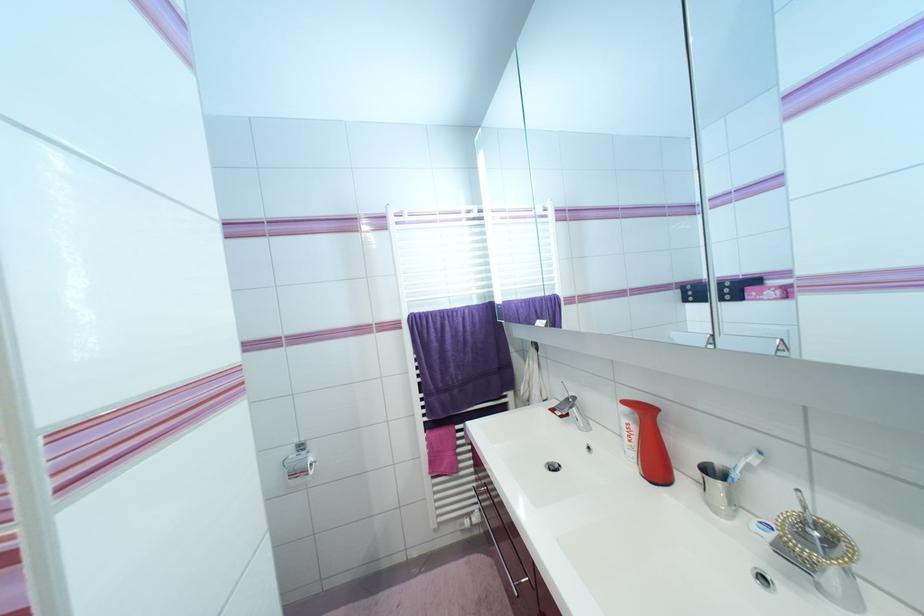
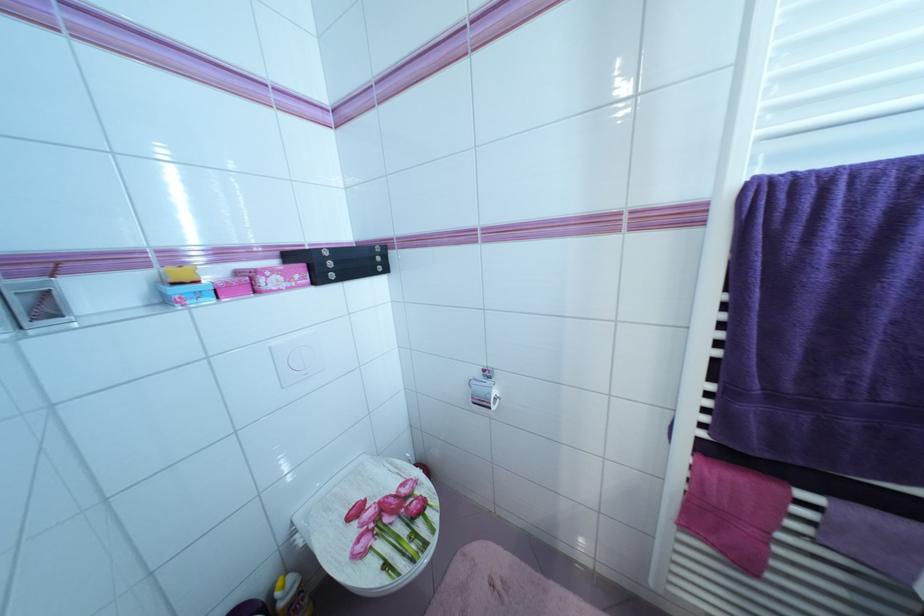
Where in the second image is the point corresponding to [309,454] from the first image?

(493, 383)